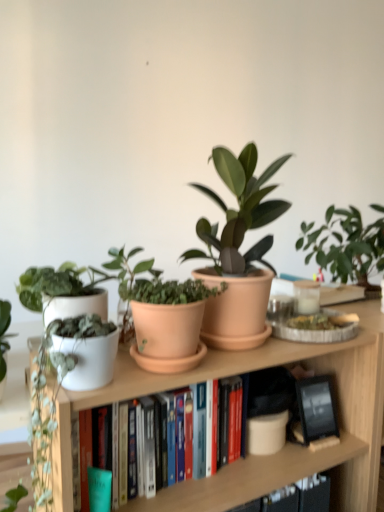
What is the approximate width of terracotta clay pot at center, the second houseplant in the left-to-right sequence?

terracotta clay pot at center, the second houseplant in the left-to-right sequence, is 5.77 inches wide.

Image resolution: width=384 pixels, height=512 pixels. Describe the element at coordinates (237, 250) in the screenshot. I see `matte terracotta pot at center, the first houseplant from the right` at that location.

Where is `white matte book at center`? This screenshot has height=512, width=384. white matte book at center is located at coordinates (114, 451).

The width and height of the screenshot is (384, 512). I want to click on terracotta clay pot at center, which is counted as the 2th houseplant, starting from the right, so click(x=163, y=315).

From a real-world perspective, is white matte book at center physically below terracotta clay pot at center, which is counted as the 2th houseplant, starting from the right?

Yes, from a real-world perspective, white matte book at center is under terracotta clay pot at center, which is counted as the 2th houseplant, starting from the right.

Who is bigger, white matte book at center or terracotta clay pot at center, which is counted as the 2th houseplant, starting from the right?

white matte book at center is bigger.

In terms of width, does white matte book at center look wider or thinner when compared to terracotta clay pot at center, which is counted as the 2th houseplant, starting from the right?

In the image, white matte book at center appears to be wider than terracotta clay pot at center, which is counted as the 2th houseplant, starting from the right.

From the image's perspective, is white matte book at center positioned above or below white matte plant pot at left?

Clearly, from the image's perspective, white matte book at center is above white matte plant pot at left.

Locate an element on the screen. The height and width of the screenshot is (512, 384). book behind the white matte plant pot at left is located at coordinates (114, 451).

Is white matte book at center wider than white matte plant pot at left?

No.

Consider the image. Is white matte book at center taller or shorter than white matte plant pot at left?

white matte book at center is shorter than white matte plant pot at left.

Is white matte pot at left, marked as the 3th houseplant in a right-to-left arrangement, next to matte terracotta pot at center, the first houseplant from the right, and touching it?

There is a gap between white matte pot at left, marked as the 3th houseplant in a right-to-left arrangement, and matte terracotta pot at center, the first houseplant from the right.

Is white matte pot at left, marked as the 3th houseplant in a right-to-left arrangement, situated inside matte terracotta pot at center, the first houseplant from the right, or outside?

white matte pot at left, marked as the 3th houseplant in a right-to-left arrangement, exists outside the volume of matte terracotta pot at center, the first houseplant from the right.

Considering the positions of objects white matte pot at left, which is the first houseplant from left to right, and matte terracotta pot at center, acting as the 3th houseplant starting from the left, in the image provided, who is more to the right, white matte pot at left, which is the first houseplant from left to right, or matte terracotta pot at center, acting as the 3th houseplant starting from the left,?

matte terracotta pot at center, acting as the 3th houseplant starting from the left, is more to the right.

From the image's perspective, is white matte plant pot at left located above or below matte terracotta pot at center, acting as the 3th houseplant starting from the left?

white matte plant pot at left is below matte terracotta pot at center, acting as the 3th houseplant starting from the left.

Measure the distance from white matte plant pot at left to matte terracotta pot at center, the first houseplant from the right.

white matte plant pot at left and matte terracotta pot at center, the first houseplant from the right, are 10.83 inches apart from each other.

Between white matte plant pot at left and matte terracotta pot at center, acting as the 3th houseplant starting from the left, which one is positioned behind?

matte terracotta pot at center, acting as the 3th houseplant starting from the left, is further from the camera.

Where is `houseplant that is the 3rd one when counting backward from the white matte plant pot at left`? houseplant that is the 3rd one when counting backward from the white matte plant pot at left is located at coordinates (237, 250).

In terms of width, does terracotta clay pot at center, the second houseplant in the left-to-right sequence, look wider or thinner when compared to white matte book at center?

In the image, terracotta clay pot at center, the second houseplant in the left-to-right sequence, appears to be more narrow than white matte book at center.

Is terracotta clay pot at center, which is counted as the 2th houseplant, starting from the right, positioned with its back to white matte book at center?

No, terracotta clay pot at center, which is counted as the 2th houseplant, starting from the right, is not facing away from white matte book at center.

Which is behind, point (145, 348) or point (164, 434)?

The point (164, 434) is farther from the camera.

Considering the sizes of objects terracotta clay pot at center, the second houseplant in the left-to-right sequence, and white matte book at center in the image provided, who is shorter, terracotta clay pot at center, the second houseplant in the left-to-right sequence, or white matte book at center?

terracotta clay pot at center, the second houseplant in the left-to-right sequence, is shorter.

Would you consider white matte plant pot at left to be distant from white matte pot at left, marked as the 3th houseplant in a right-to-left arrangement?

No, there isn't a large distance between white matte plant pot at left and white matte pot at left, marked as the 3th houseplant in a right-to-left arrangement.

Does white matte plant pot at left have a lesser height compared to white matte pot at left, marked as the 3th houseplant in a right-to-left arrangement?

No.

From a real-world perspective, which object rests below the other?

white matte plant pot at left, from a real-world perspective.

From the image's perspective, who appears lower, white matte plant pot at left or white matte pot at left, marked as the 3th houseplant in a right-to-left arrangement?

white matte plant pot at left is shown below in the image.

Is matte terracotta pot at center, the first houseplant from the right, positioned beyond the bounds of terracotta clay pot at center, the second houseplant in the left-to-right sequence?

Yes, matte terracotta pot at center, the first houseplant from the right, is not within terracotta clay pot at center, the second houseplant in the left-to-right sequence.

Does matte terracotta pot at center, acting as the 3th houseplant starting from the left, have a greater width compared to terracotta clay pot at center, the second houseplant in the left-to-right sequence?

Correct, the width of matte terracotta pot at center, acting as the 3th houseplant starting from the left, exceeds that of terracotta clay pot at center, the second houseplant in the left-to-right sequence.

Considering the relative positions of matte terracotta pot at center, acting as the 3th houseplant starting from the left, and terracotta clay pot at center, which is counted as the 2th houseplant, starting from the right, in the image provided, is matte terracotta pot at center, acting as the 3th houseplant starting from the left, to the left or to the right of terracotta clay pot at center, which is counted as the 2th houseplant, starting from the right,?

Based on their positions, matte terracotta pot at center, acting as the 3th houseplant starting from the left, is located to the right of terracotta clay pot at center, which is counted as the 2th houseplant, starting from the right.

Which is less distant, (212,232) or (196,360)?

Point (196,360)

Starting from the white matte book at center, which houseplant is the 2nd one in front? Please provide its 2D coordinates.

[(163, 315)]

I want to click on bookcase that appears below the white matte book at center (from the image's perspective), so click(x=285, y=446).

Estimate the real-world distances between objects in this image. Which object is further from white matte book at center, terracotta clay pot at center, which is counted as the 2th houseplant, starting from the right, or white matte plant pot at left?

terracotta clay pot at center, which is counted as the 2th houseplant, starting from the right, is further to white matte book at center.

Looking at the image, which one is located further to white matte pot at left, marked as the 3th houseplant in a right-to-left arrangement, matte terracotta pot at center, the first houseplant from the right, or terracotta clay pot at center, which is counted as the 2th houseplant, starting from the right?

matte terracotta pot at center, the first houseplant from the right.

Considering their positions, is terracotta clay pot at center, which is counted as the 2th houseplant, starting from the right, positioned closer to white matte plant pot at left than white matte pot at left, marked as the 3th houseplant in a right-to-left arrangement?

terracotta clay pot at center, which is counted as the 2th houseplant, starting from the right.

Considering their positions, is white matte plant pot at left positioned closer to white matte pot at left, marked as the 3th houseplant in a right-to-left arrangement, than matte terracotta pot at center, the first houseplant from the right?

white matte plant pot at left is closer to white matte pot at left, marked as the 3th houseplant in a right-to-left arrangement.

Based on their spatial positions, is white matte book at center or white matte plant pot at left further from white matte pot at left, which is the first houseplant from left to right?

white matte plant pot at left is positioned further to the anchor white matte pot at left, which is the first houseplant from left to right.

Considering their positions, is white matte plant pot at left positioned further to white matte book at center than terracotta clay pot at center, the second houseplant in the left-to-right sequence?

terracotta clay pot at center, the second houseplant in the left-to-right sequence.

From the image, which object appears to be nearer to terracotta clay pot at center, which is counted as the 2th houseplant, starting from the right, white matte pot at left, which is the first houseplant from left to right, or white matte plant pot at left?

white matte pot at left, which is the first houseplant from left to right, is positioned closer to the anchor terracotta clay pot at center, which is counted as the 2th houseplant, starting from the right.

From the image, which object appears to be farther from white matte book at center, white matte pot at left, marked as the 3th houseplant in a right-to-left arrangement, or white matte plant pot at left?

white matte pot at left, marked as the 3th houseplant in a right-to-left arrangement.

I want to click on houseplant between white matte pot at left, marked as the 3th houseplant in a right-to-left arrangement, and white matte book at center from top to bottom, so click(163, 315).

At what (x,y) coordinates should I click in order to perform the action: click on houseplant between white matte pot at left, which is the first houseplant from left to right, and white matte plant pot at left from top to bottom. Please return your answer as a coordinate pair (x, y). This screenshot has width=384, height=512. Looking at the image, I should click on coord(163,315).

Where is `book between white matte pot at left, marked as the 3th houseplant in a right-to-left arrangement, and white matte plant pot at left vertically`? This screenshot has height=512, width=384. book between white matte pot at left, marked as the 3th houseplant in a right-to-left arrangement, and white matte plant pot at left vertically is located at coordinates (114, 451).

Find the location of a particular element. houseplant located between white matte pot at left, marked as the 3th houseplant in a right-to-left arrangement, and matte terracotta pot at center, acting as the 3th houseplant starting from the left, in the left-right direction is located at coordinates (163, 315).